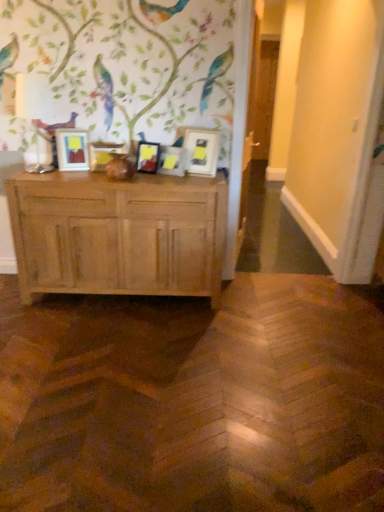
At what (x,y) coordinates should I click in order to perform the action: click on free point above light brown wood chest of drawers at center (from a real-world perspective). Please return your answer as a coordinate pair (x, y). Looking at the image, I should click on [x=107, y=178].